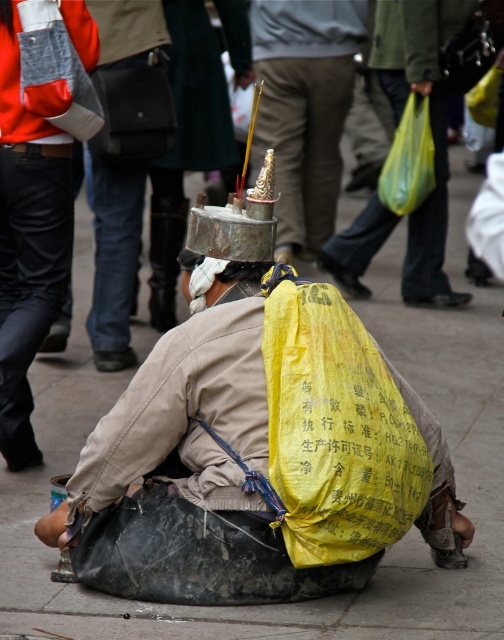
Question: Is yellow fabric bag at center smaller than yellow fabric bag at lower center?

Choices:
 (A) no
 (B) yes

Answer: (A)

Question: Which object is closer to the camera taking this photo?

Choices:
 (A) yellow fabric bag at lower center
 (B) yellow fabric bag at center

Answer: (A)

Question: Estimate the real-world distances between objects in this image. Which object is farther from the yellow fabric bag at lower center?

Choices:
 (A) metallic gold incense burner at center
 (B) yellow fabric bag at center

Answer: (A)

Question: Can you confirm if metallic gold incense burner at center is wider than yellow fabric bag at lower center?

Choices:
 (A) no
 (B) yes

Answer: (B)

Question: Which point appears closest to the camera in this image?

Choices:
 (A) (243, 440)
 (B) (270, 136)
 (C) (428, 16)

Answer: (A)

Question: Considering the relative positions of yellow fabric bag at center and yellow fabric bag at lower center in the image provided, where is yellow fabric bag at center located with respect to yellow fabric bag at lower center?

Choices:
 (A) above
 (B) below

Answer: (A)